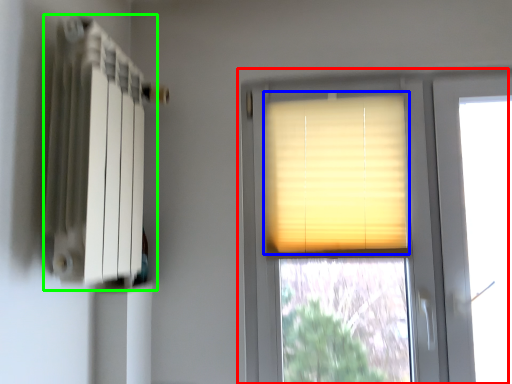
Question: Based on their relative distances, which object is nearer to window (highlighted by a red box)? Choose from window blind (highlighted by a blue box) and radiator (highlighted by a green box).

Choices:
 (A) window blind
 (B) radiator

Answer: (A)